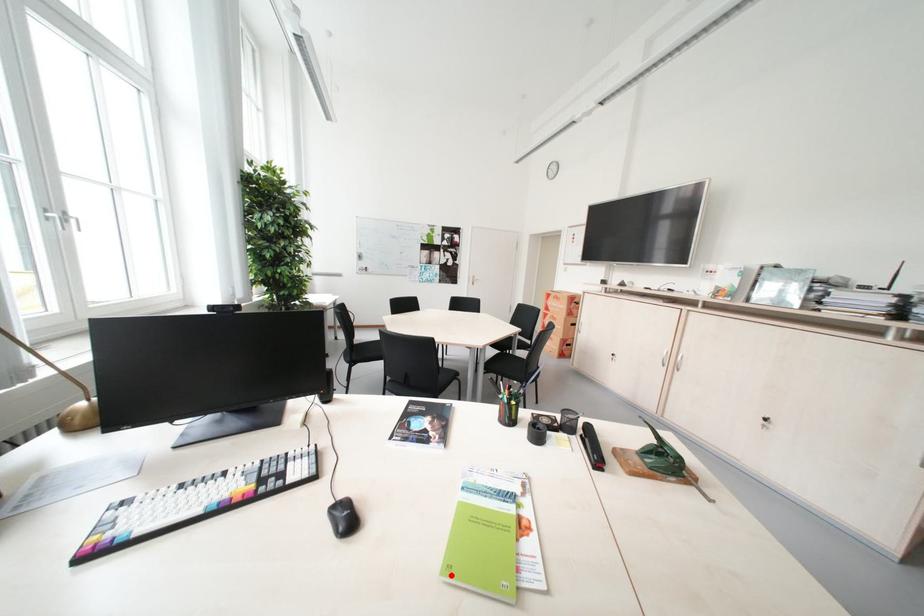
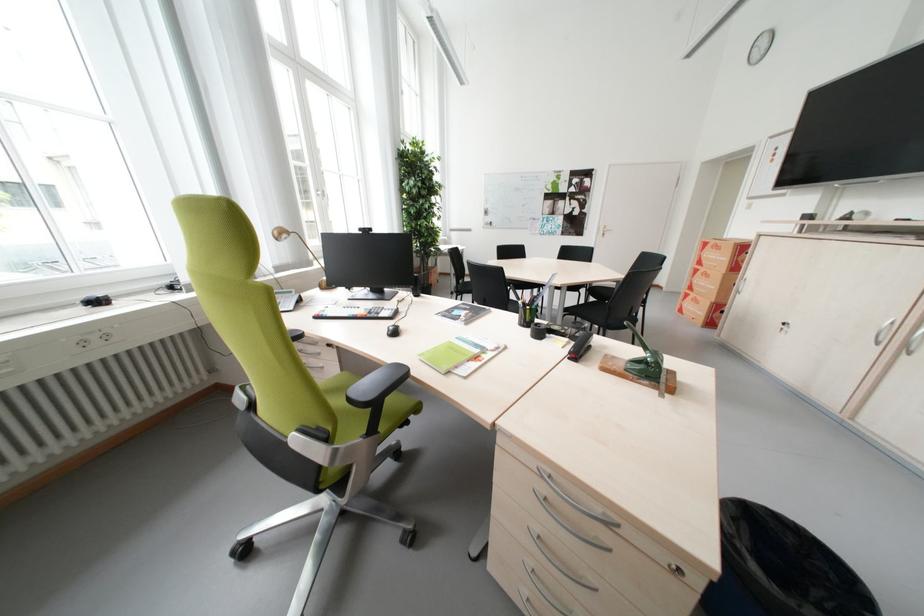
Question: I am providing you with two images of the same scene from different viewpoints. In image1, a red point is highlighted. Considering the same 3D point in image2, which of the following is correct?

Choices:
 (A) It is closer
 (B) It is farther

Answer: (A)